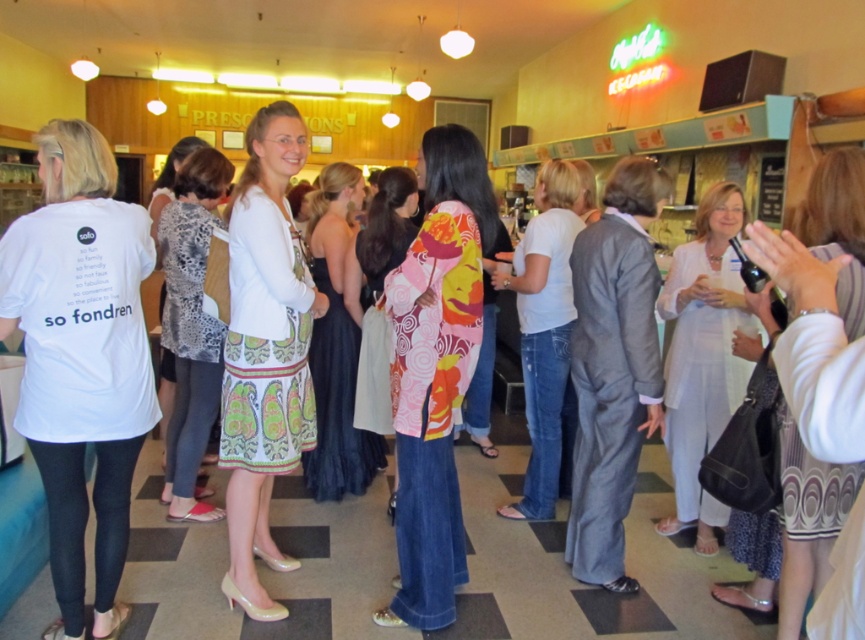
Is floral-patterned fabric at center thinner than white printed t-shirt at center?

In fact, floral-patterned fabric at center might be wider than white printed t-shirt at center.

From the picture: Can you confirm if floral-patterned fabric at center is positioned to the left of white printed t-shirt at center?

Incorrect, floral-patterned fabric at center is not on the left side of white printed t-shirt at center.

Between point (471, 147) and point (234, 378), which one is positioned behind?

The point (234, 378) is more distant.

Find the location of a particular element. floral-patterned fabric at center is located at coordinates (434, 372).

Does white matte t-shirt at left come in front of white cotton shirt at center?

Yes, white matte t-shirt at left is in front of white cotton shirt at center.

Measure the distance between point (63, 582) and camera.

Point (63, 582) is 2.29 meters away from camera.

Which is in front, point (34, 236) or point (527, 227)?

Point (34, 236) is in front.

The width and height of the screenshot is (865, 640). Identify the location of white matte t-shirt at left. (81, 358).

Can you confirm if patterned fabric dress at center is thinner than floral-patterned dress at center?

Indeed, patterned fabric dress at center has a lesser width compared to floral-patterned dress at center.

Between point (854, 310) and point (413, 209), which one is positioned behind?

Positioned behind is point (413, 209).

This screenshot has width=865, height=640. What are the coordinates of `patterned fabric dress at center` in the screenshot? It's located at (808, 522).